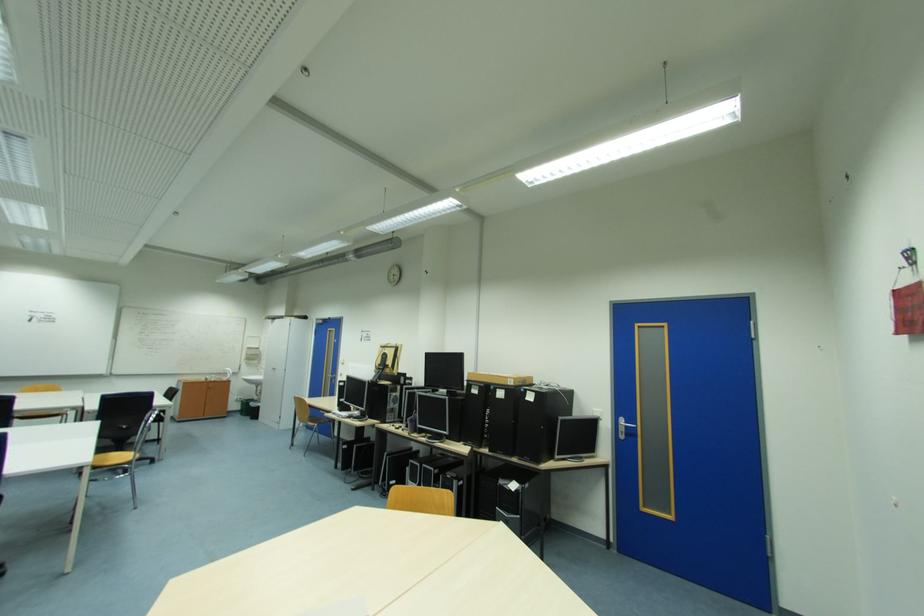
Which object does [245,406] point to?

This point indicates the green trash can.